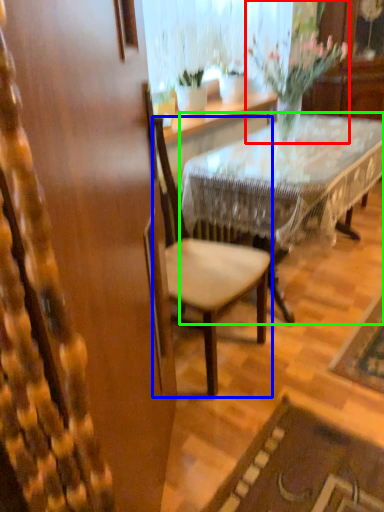
Question: Considering the real-world distances, which object is closest to houseplant (highlighted by a red box)? chair (highlighted by a blue box) or desk (highlighted by a green box).

Choices:
 (A) chair
 (B) desk

Answer: (B)